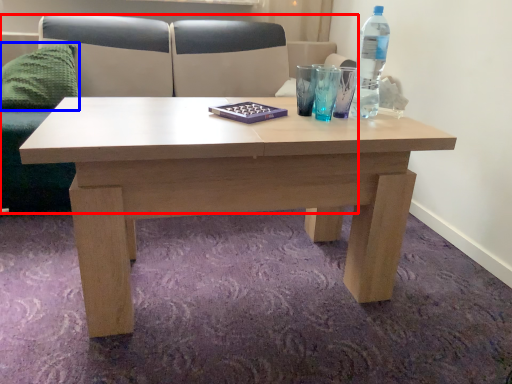
Question: Which point is closer to the camera, couch (highlighted by a red box) or pillow (highlighted by a blue box)?

Choices:
 (A) couch
 (B) pillow

Answer: (A)